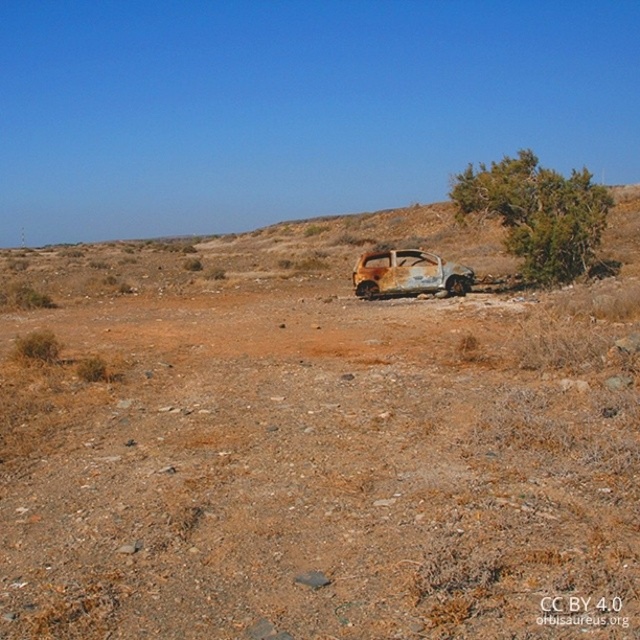
You are a hiker lost in the desert and see the green leafy bush at center and the rusty metal car at center. Which object is closer to you?

The green leafy bush at center is closer to the viewer than the rusty metal car at center.

You are standing at the point marked by the coordinates point (561, 182) in the desolate, arid landscape. You want to walk straight towards the abandoned car in the midground. How far will you have to walk to reach the car?

The distance between you and the abandoned car is 20.38 meters, so you will have to walk 20.38 meters to reach the car.

You are a hiker lost in the desert and you see a green leafy bush at center and a rusty metal car at center. Which object would you prioritize checking for potential water or shade?

The green leafy bush at center is larger in size than the rusty metal car at center, so the bush would provide better shade and might have water stored in its leaves or roots.